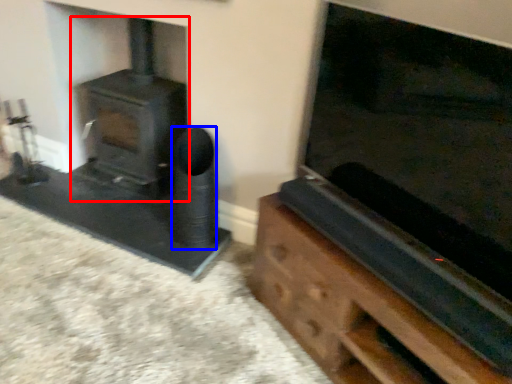
Question: Among these objects, which one is farthest to the camera, wood burning stove (highlighted by a red box) or speaker (highlighted by a blue box)?

Choices:
 (A) wood burning stove
 (B) speaker

Answer: (A)